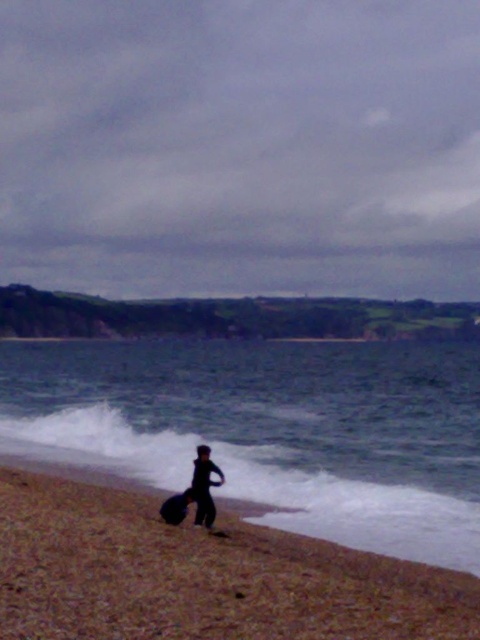
You are a hiker who wants to cross from the brown sandy beach at lower left to the blue water at lower center. Is the path directly between them blocked by any object?

The blue water at lower center is positioned under brown sandy beach at lower left, meaning there is no object blocking the path between them. You can cross directly from the brown sandy beach at lower left to the blue water at lower center.

You are a photographer trying to capture the brown sandy beach at lower left and the black matte surfboard at lower center in the same frame. Based on their positions, which object would appear closer to the camera?

The brown sandy beach at lower left is in front of the black matte surfboard at lower center, so it would appear closer to the camera.

You are standing on the beach in the coastal scene described. You want to walk to the blue water at lower center. Which direction should you head? The coordinates of the blue water are given as point (x=271, y=429). Please provide your answer in terms of compass directions like north, south, etc., or relative directions like forward, backward, left, or right based on your current position on the beach.

Since the blue water at lower center is represented by point (x=271, y=429), you should head forward towards the lower part of the scene to reach it.